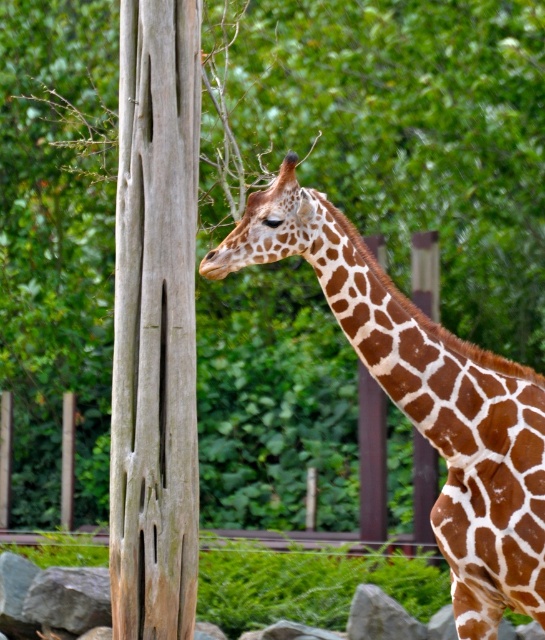
From the picture: You are standing at the entrance of the enclosure and see two points marked in the image. The first point is at coordinates point [166,284] and the second point is at point [482,461]. Which point is closer to you?

Point [166,284] is in front of point [482,461], so it is closer to you.

You are standing in front of the giraffe enclosure and notice a point at coordinates (155, 323). Based on the scene description, what object is located at that point?

The point at coordinates (155, 323) indicates the weathered wood tree trunk at left.

You are a zookeeper who needs to ensure the brown spotted giraffe at center has enough space to move freely. Considering the weathered wood tree trunk at left is smaller than the giraffe, is there enough space between them for the giraffe to move comfortably?

The weathered wood tree trunk at left is smaller than the brown spotted giraffe at center, so there should be sufficient space for the giraffe to move comfortably between them.